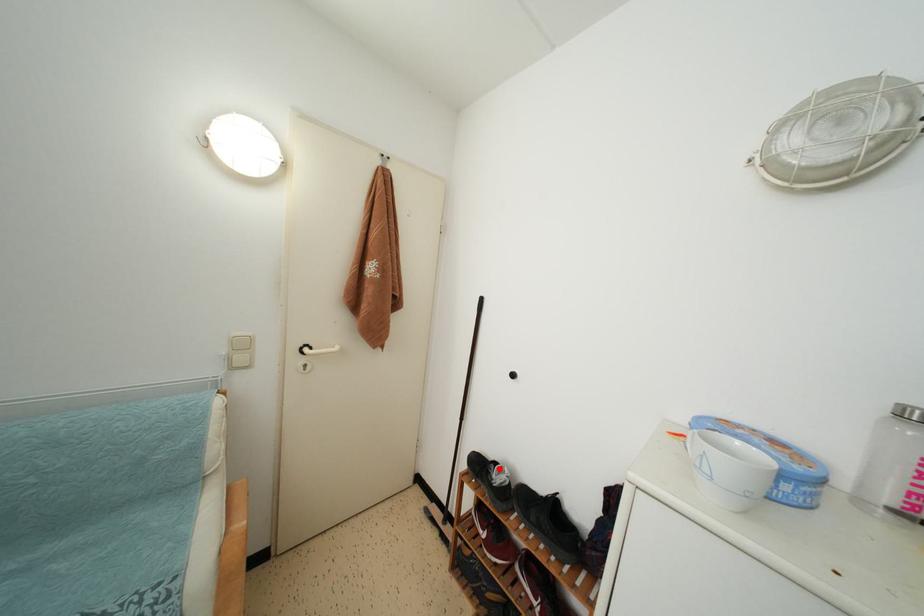
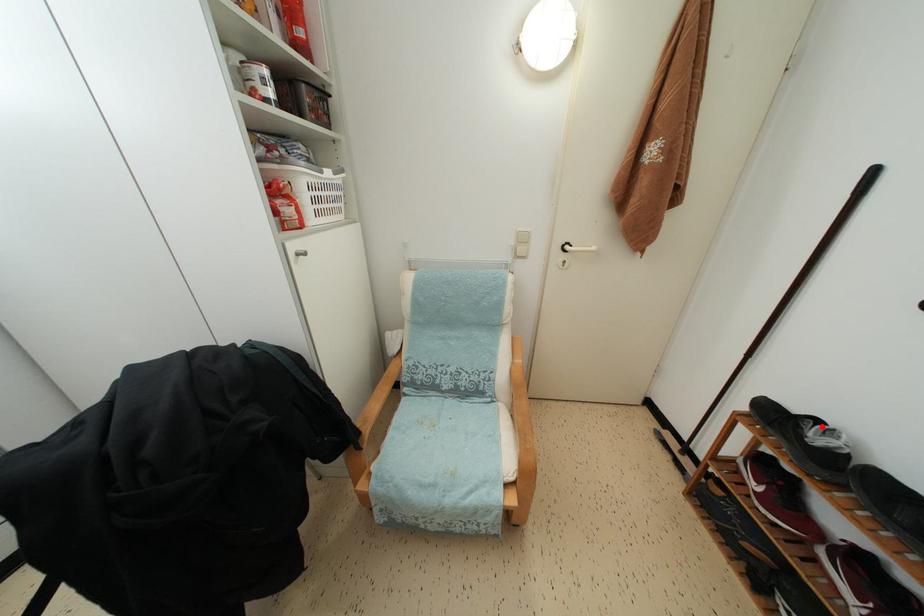
I am providing you with two images of the same scene from different viewpoints. A red point is marked on the first image and another point is marked on the second image. Is the red point in image1 aligned with the point shown in image2?

Yes